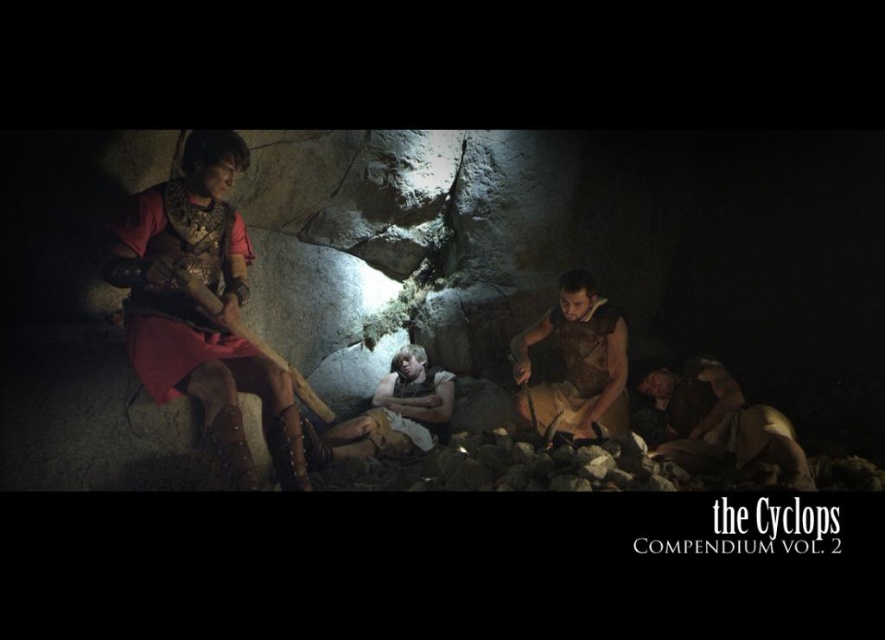
You are an explorer in the cave and need to pass through a narrow passage. You see the matte red tunic at left and the brown leather armor at lower right. Which item should you move to ensure there is enough space to pass through the passage?

The matte red tunic at left might be wider than the brown leather armor at lower right, so moving the matte red tunic at left would likely create more space for you to pass through the narrow passage.